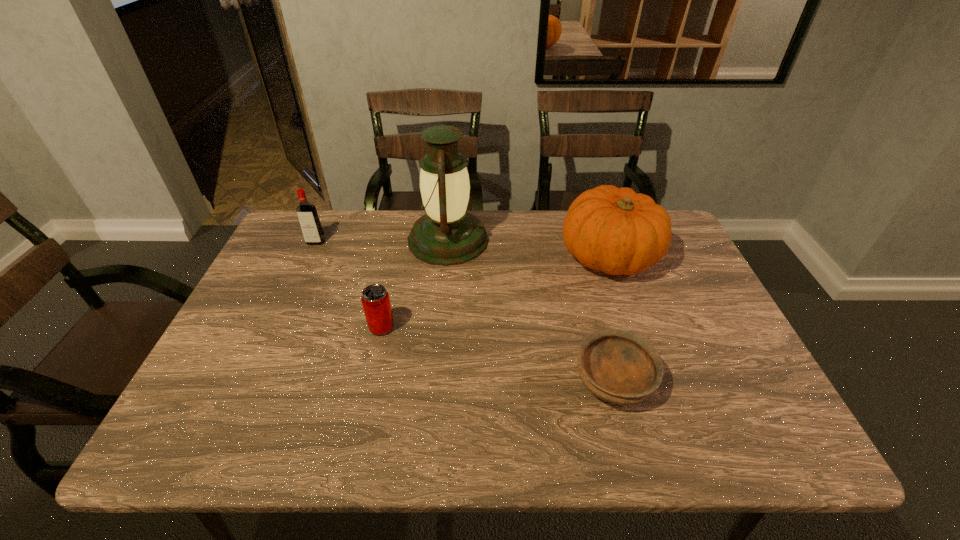
Locate an element on the screen. The width and height of the screenshot is (960, 540). unoccupied area between the second shortest object and the nearest object is located at coordinates (497, 354).

What are the coordinates of `free space that is in between the vodka and the nearest object` in the screenshot? It's located at (465, 311).

The height and width of the screenshot is (540, 960). Identify the location of vacant area that lies between the fourth tallest object and the leftmost object. (348, 285).

Find the location of a particular element. free space between the shortest object and the leftmost object is located at coordinates (465, 311).

Image resolution: width=960 pixels, height=540 pixels. I want to click on free space between the second shortest object and the shortest object, so click(x=497, y=354).

At what (x,y) coordinates should I click in order to perform the action: click on free space that is in between the fourth tallest object and the shortest object. Please return your answer as a coordinate pair (x, y). The image size is (960, 540). Looking at the image, I should click on (497, 354).

Find the location of a particular element. The image size is (960, 540). vacant space that's between the vodka and the shortest object is located at coordinates (465, 311).

Image resolution: width=960 pixels, height=540 pixels. I want to click on object that can be found as the second closest to the nearest object, so click(447, 234).

The height and width of the screenshot is (540, 960). I want to click on the third closest object to the leftmost object, so click(614, 230).

Locate an element on the screen. vacant space that satisfies the following two spatial constraints: 1. with the light compartment facing forward on the nearest object; 2. on the right side of the tallest object is located at coordinates (436, 381).